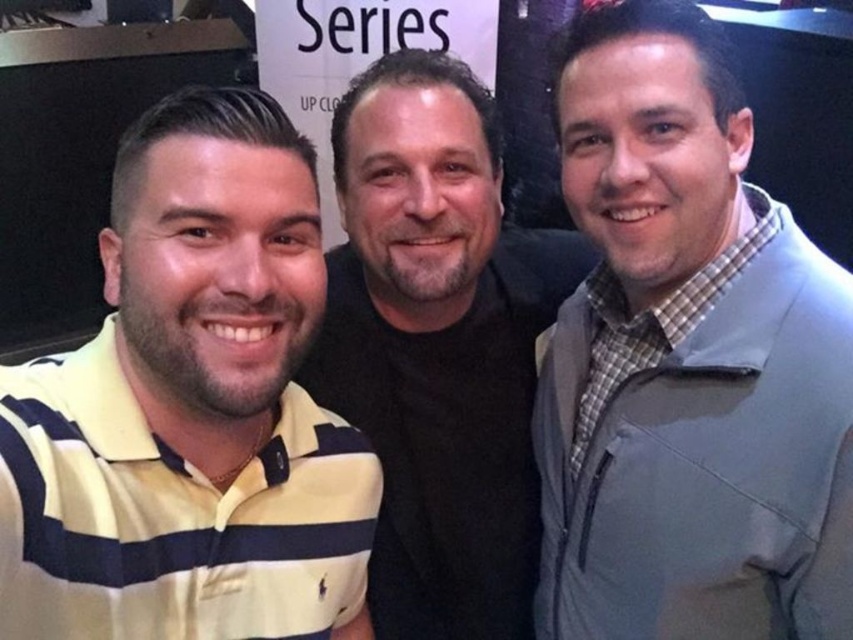
You are a photographer trying to adjust the camera focus. You notice the yellow striped polo shirt at left and the black matte shirt at center. Which one is shorter in height?

The yellow striped polo shirt at left is not as tall as the black matte shirt at center, so the yellow striped polo shirt at left is shorter in height.

You are holding a 70 cm long measuring tape and want to measure the distance from your eyes to the point at coordinates point (804, 532) in the image. Can you reach the point with your measuring tape?

The distance between the point (804, 532) and the viewer is 75.42 centimeters. Since the measuring tape is 70 cm long, it is shorter than the required distance, so you cannot reach the point with your measuring tape.